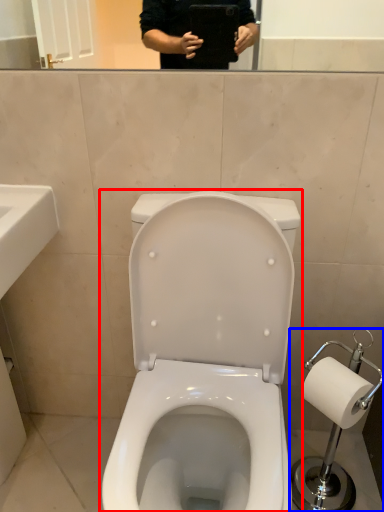
Question: Among these objects, which one is nearest to the camera, toilet (highlighted by a red box) or scale (highlighted by a blue box)?

Choices:
 (A) toilet
 (B) scale

Answer: (A)